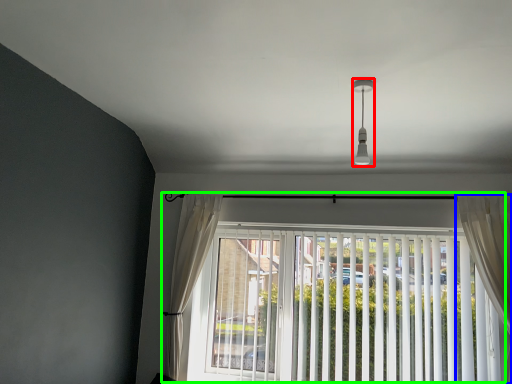
Question: Estimate the real-world distances between objects in this image. Which object is closer to light fixture (highlighted by a red box), curtain (highlighted by a blue box) or window (highlighted by a green box)?

Choices:
 (A) curtain
 (B) window

Answer: (A)